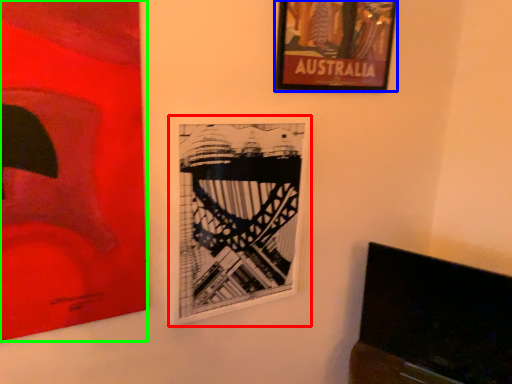
Question: Which is nearer to the picture frame (highlighted by a red box)? picture frame (highlighted by a blue box) or picture frame (highlighted by a green box).

Choices:
 (A) picture frame
 (B) picture frame

Answer: (B)